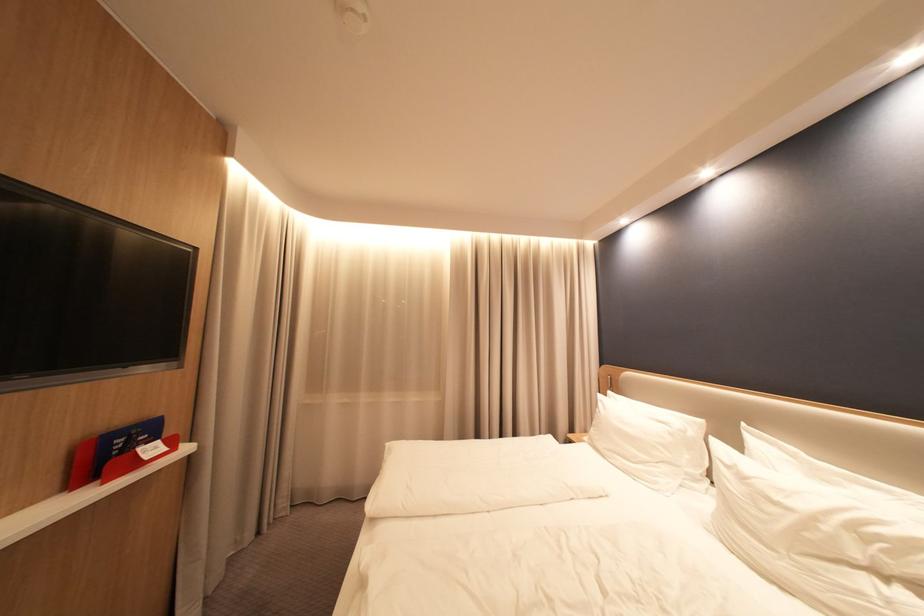
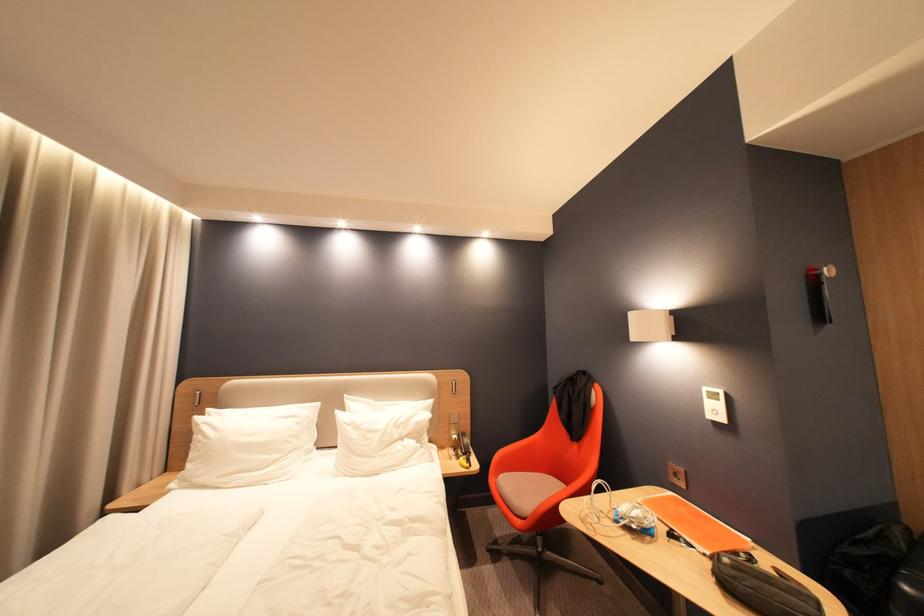
Where in the second image is the point corresponding to point 737,464 from the first image?

(359, 424)